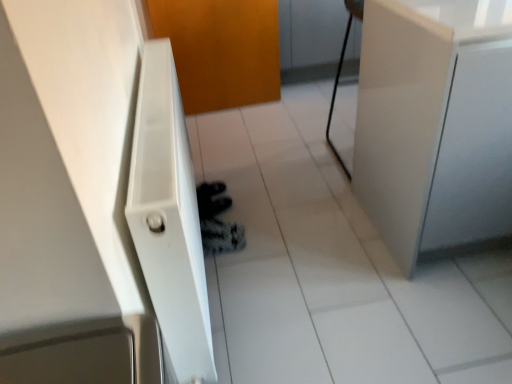
Question: Does white glossy cabinet at right appear on the right side of white textured radiator at left?

Choices:
 (A) no
 (B) yes

Answer: (B)

Question: From a real-world perspective, is white glossy cabinet at right on white textured radiator at left?

Choices:
 (A) yes
 (B) no

Answer: (A)

Question: Can you confirm if white glossy cabinet at right is taller than white textured radiator at left?

Choices:
 (A) no
 (B) yes

Answer: (B)

Question: Is white glossy cabinet at right positioned with its back to white textured radiator at left?

Choices:
 (A) yes
 (B) no

Answer: (B)

Question: Does white glossy cabinet at right have a smaller size compared to white textured radiator at left?

Choices:
 (A) yes
 (B) no

Answer: (B)

Question: Considering the relative positions of white glossy cabinet at right and white textured radiator at left in the image provided, is white glossy cabinet at right to the left of white textured radiator at left from the viewer's perspective?

Choices:
 (A) no
 (B) yes

Answer: (A)

Question: From a real-world perspective, is orange matte door at center physically above white glossy cabinet at right?

Choices:
 (A) no
 (B) yes

Answer: (A)

Question: Can you confirm if orange matte door at center is taller than white glossy cabinet at right?

Choices:
 (A) no
 (B) yes

Answer: (A)

Question: Does orange matte door at center have a smaller size compared to white glossy cabinet at right?

Choices:
 (A) yes
 (B) no

Answer: (A)

Question: Could you tell me if orange matte door at center is turned towards white glossy cabinet at right?

Choices:
 (A) yes
 (B) no

Answer: (A)

Question: Is orange matte door at center shorter than white glossy cabinet at right?

Choices:
 (A) no
 (B) yes

Answer: (B)

Question: Considering the relative sizes of orange matte door at center and white glossy cabinet at right in the image provided, is orange matte door at center thinner than white glossy cabinet at right?

Choices:
 (A) no
 (B) yes

Answer: (B)

Question: Does white glossy tile at center appear on the right side of orange matte door at center?

Choices:
 (A) yes
 (B) no

Answer: (A)